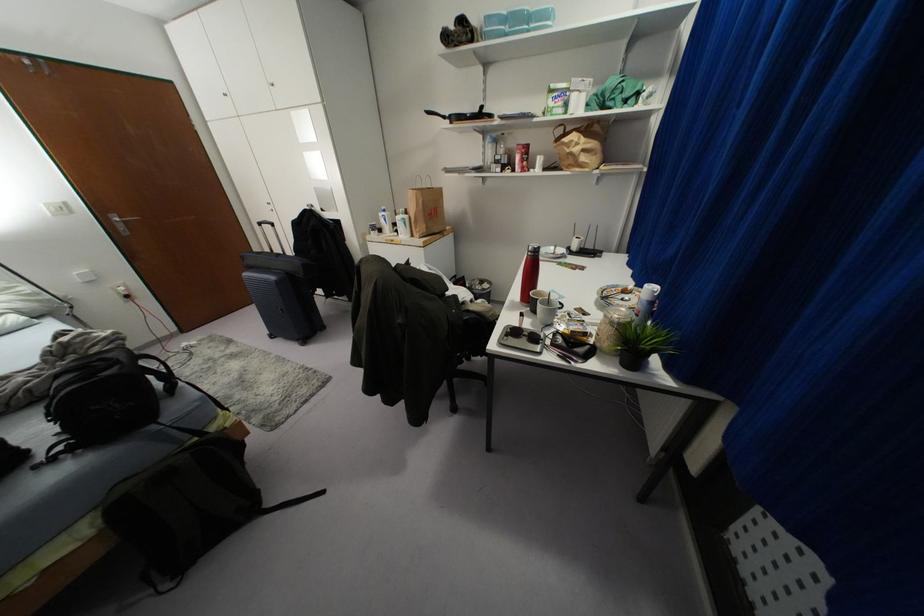
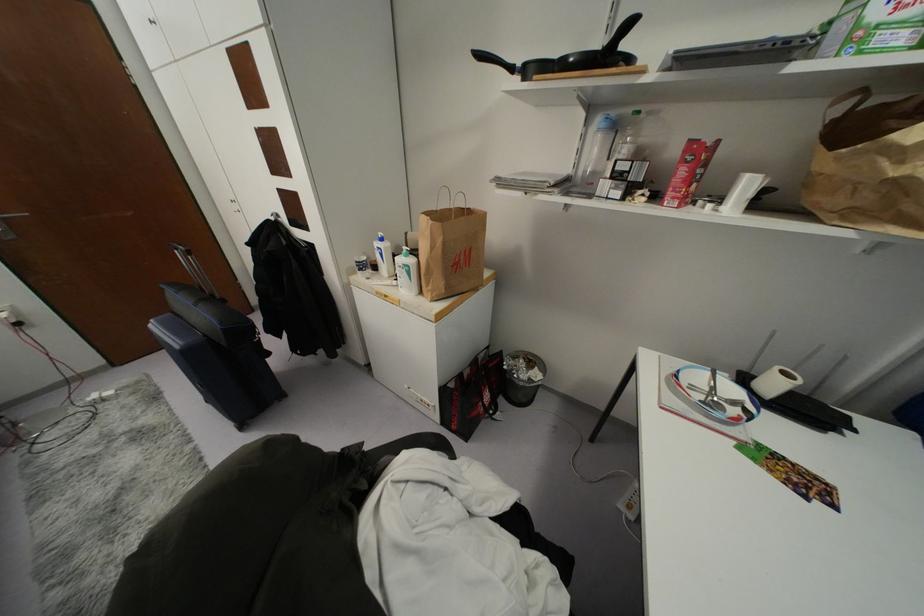
Find the pixel in the second image that matches the point at 405,216 in the first image.

(410, 261)